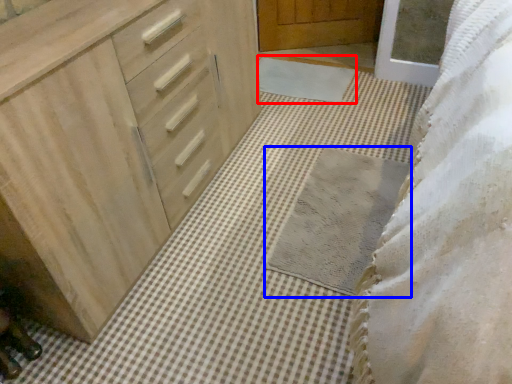
Question: Which object is further to the camera taking this photo, bath mat (highlighted by a red box) or bath mat (highlighted by a blue box)?

Choices:
 (A) bath mat
 (B) bath mat

Answer: (A)